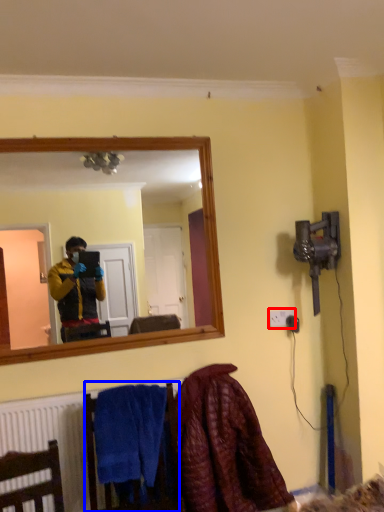
Question: Which object is closer to the camera taking this photo, electric outlet (highlighted by a red box) or armchair (highlighted by a blue box)?

Choices:
 (A) electric outlet
 (B) armchair

Answer: (B)